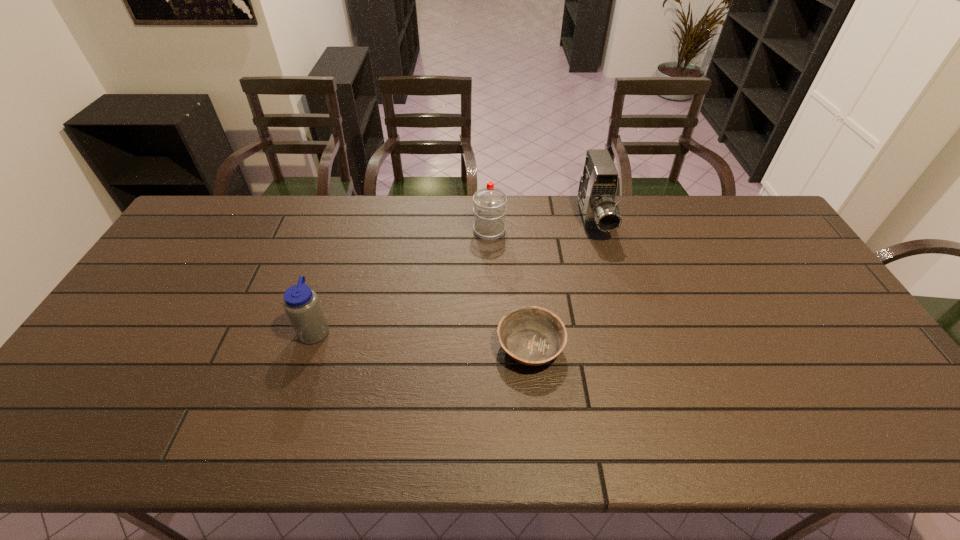
Where is `free space that satisfies the following two spatial constraints: 1. with a carrying loop on the side of the shortest object; 2. on the right side of the shorter water bottle`? The image size is (960, 540). free space that satisfies the following two spatial constraints: 1. with a carrying loop on the side of the shortest object; 2. on the right side of the shorter water bottle is located at coordinates pos(310,347).

This screenshot has height=540, width=960. I want to click on blank space that satisfies the following two spatial constraints: 1. at the front of the camcorder, highlighting the lens; 2. with a carrying loop on the side of the second shortest object, so click(x=625, y=330).

This screenshot has height=540, width=960. I want to click on vacant position in the image that satisfies the following two spatial constraints: 1. at the front of the camcorder, highlighting the lens; 2. with a carrying loop on the side of the third tallest object, so click(x=625, y=330).

This screenshot has height=540, width=960. Find the location of `blank area in the image that satisfies the following two spatial constraints: 1. with a carrying loop on the side of the shorter water bottle; 2. on the right side of the bowl`. blank area in the image that satisfies the following two spatial constraints: 1. with a carrying loop on the side of the shorter water bottle; 2. on the right side of the bowl is located at coordinates (310, 347).